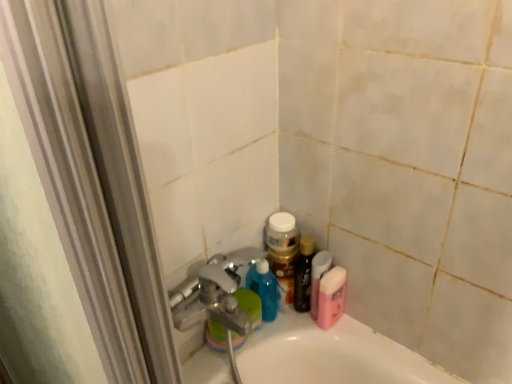
Question: From a real-world perspective, is shiny brown bottle at lower right above or below pink glossy bottle at upper right, which is the first mouthwash in left-to-right order?

Choices:
 (A) above
 (B) below

Answer: (A)

Question: From the image's perspective, is shiny brown bottle at lower right positioned above or below pink glossy bottle at upper right, which is the first mouthwash in left-to-right order?

Choices:
 (A) below
 (B) above

Answer: (B)

Question: Which of these objects is positioned closest to the shiny brown bottle at lower right?

Choices:
 (A) pink matte bottle at lower right, which is the second mouthwash from left to right
 (B) pink glossy bottle at upper right, marked as the second mouthwash in a right-to-left arrangement

Answer: (B)

Question: Based on their relative distances, which object is farther from the pink matte bottle at lower right, which is the second mouthwash from left to right?

Choices:
 (A) shiny brown bottle at lower right
 (B) pink glossy bottle at upper right, which is the first mouthwash in left-to-right order

Answer: (A)